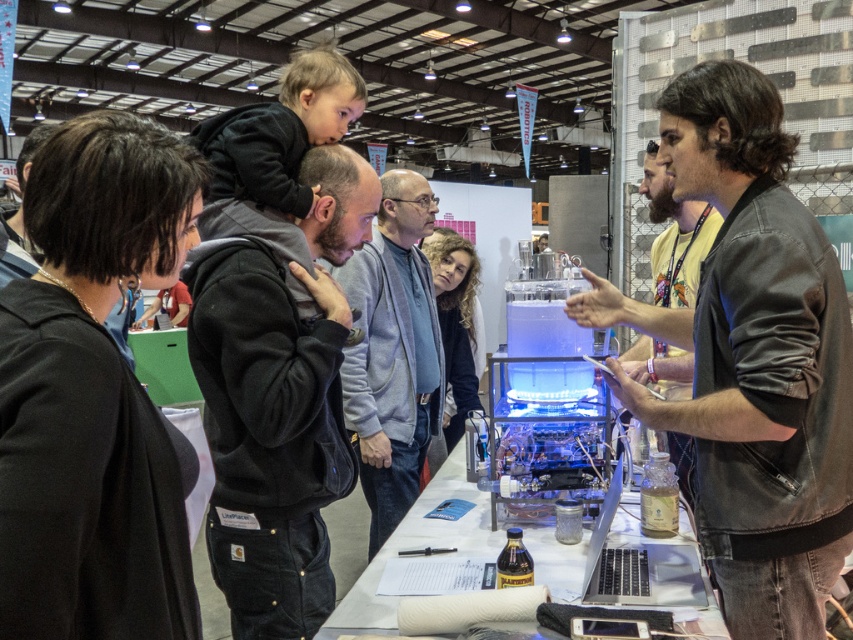
Who is more distant from viewer, (776,545) or (328,472)?

Positioned behind is point (328,472).

Is point (781, 252) positioned behind point (265, 508)?

No.

Who is more distant from viewer, [788,280] or [234,486]?

The point [234,486] is behind.

Locate an element on the screen. The image size is (853, 640). denim jacket at center is located at coordinates pyautogui.click(x=757, y=360).

Who is positioned more to the right, gray fleece hoodie at center or dark brown leather jacket at right?

dark brown leather jacket at right is more to the right.

The width and height of the screenshot is (853, 640). What do you see at coordinates (392, 352) in the screenshot?
I see `gray fleece hoodie at center` at bounding box center [392, 352].

Locate an element on the screen. gray fleece hoodie at center is located at coordinates (392, 352).

Does denim jacket at center appear on the left side of dark brown leather jacket at right?

Yes, denim jacket at center is to the left of dark brown leather jacket at right.

Is denim jacket at center behind dark brown leather jacket at right?

No, denim jacket at center is in front of dark brown leather jacket at right.

Who is more distant from viewer, [758,596] or [682,204]?

Positioned behind is point [682,204].

Identify the location of denim jacket at center. (757, 360).